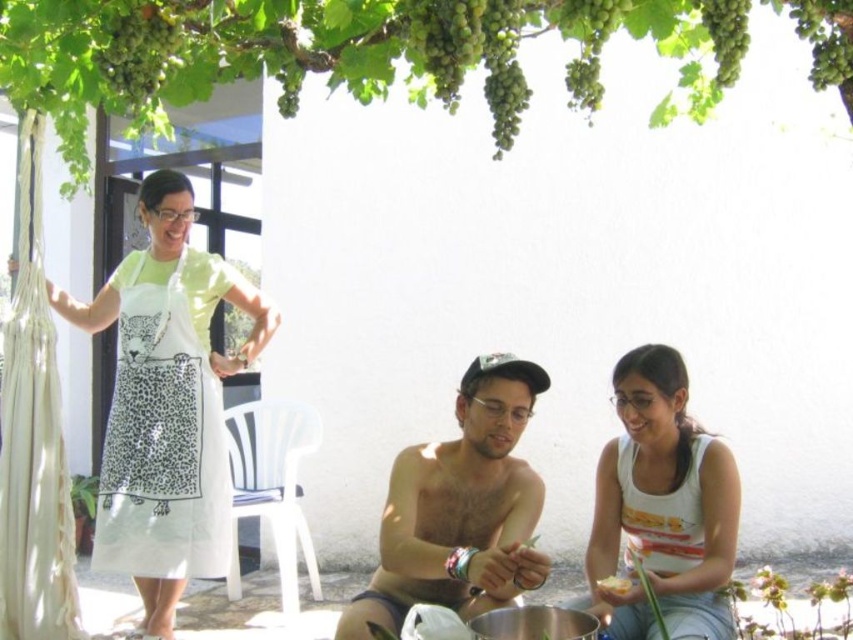
Which of these two, white apron at left or white cotton tank top at center, stands taller?

white apron at left is taller.

How far apart are white apron at left and white cotton tank top at center?

They are 5.39 feet apart.

Which is in front, point (125, 508) or point (660, 461)?

Point (660, 461)

This screenshot has width=853, height=640. In order to click on white apron at left in this screenshot , I will do [x=166, y=404].

Which of these two, green leafy tree at upper center or yellow matte leaf at lower center, stands shorter?

yellow matte leaf at lower center

Consider the image. Can you confirm if green leafy tree at upper center is wider than yellow matte leaf at lower center?

Correct, the width of green leafy tree at upper center exceeds that of yellow matte leaf at lower center.

Who is more forward, (357, 58) or (630, 579)?

Positioned in front is point (357, 58).

I want to click on green leafy tree at upper center, so click(375, 52).

Who is positioned more to the left, white cotton tank top at center or yellow matte leaf at lower center?

yellow matte leaf at lower center

Who is more forward, [614,442] or [611,586]?

Point [611,586] is in front.

Locate an element on the screen. white cotton tank top at center is located at coordinates (663, 506).